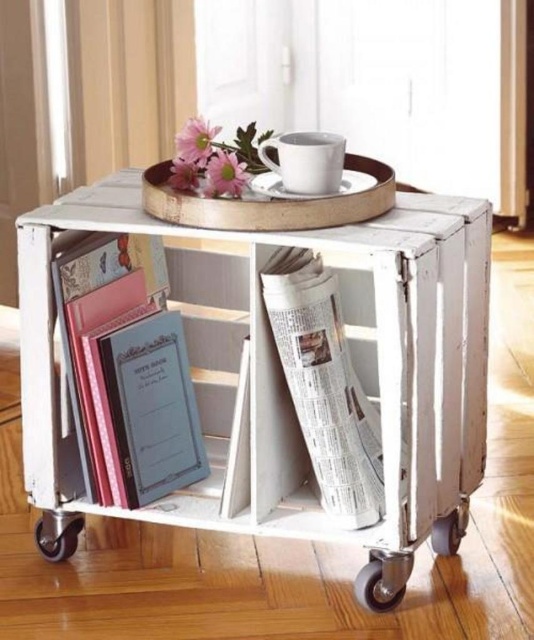
You need to move the white distressed wood cart at center through a narrow doorway that is only slightly wider than the black rubber wheel at lower right. Will the cart fit through the doorway?

The white distressed wood cart at center is wider than the black rubber wheel at lower right. Since the doorway is only slightly wider than the wheel, the cart may not fit through the doorway as its width exceeds the wheel size.

You are moving the crate and need to know which wheel is wider to ensure stability. Which wheel has a greater width between the black rubber wheel at lower left and the metallic gray wheel at lower center?

The black rubber wheel at lower left has a greater width than the metallic gray wheel at lower center according to the description, so it is wider and would provide more stability.